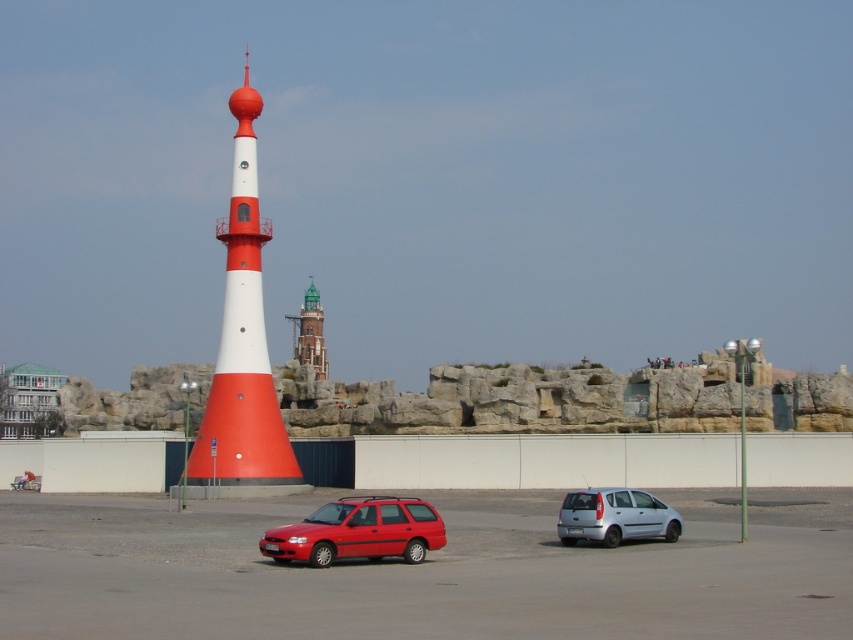
Question: Which point is farther from the camera taking this photo?

Choices:
 (A) (254, 308)
 (B) (294, 316)
 (C) (376, 529)

Answer: (B)

Question: Which object is positioned farthest from the smooth asphalt parking lot at center?

Choices:
 (A) smooth orange cone at center
 (B) green glass tower at center
 (C) shiny red station wagon at center
 (D) silver metallic hatchback at lower right

Answer: (B)

Question: Does smooth asphalt parking lot at center appear over smooth orange cone at center?

Choices:
 (A) yes
 (B) no

Answer: (B)

Question: Observing the image, what is the correct spatial positioning of smooth asphalt parking lot at center in reference to silver metallic hatchback at lower right?

Choices:
 (A) above
 (B) below

Answer: (B)

Question: Estimate the real-world distances between objects in this image. Which object is farther from the green glass tower at center?

Choices:
 (A) smooth asphalt parking lot at center
 (B) shiny red station wagon at center
 (C) smooth orange cone at center

Answer: (B)

Question: Is silver metallic hatchback at lower right below green glass tower at center?

Choices:
 (A) yes
 (B) no

Answer: (A)